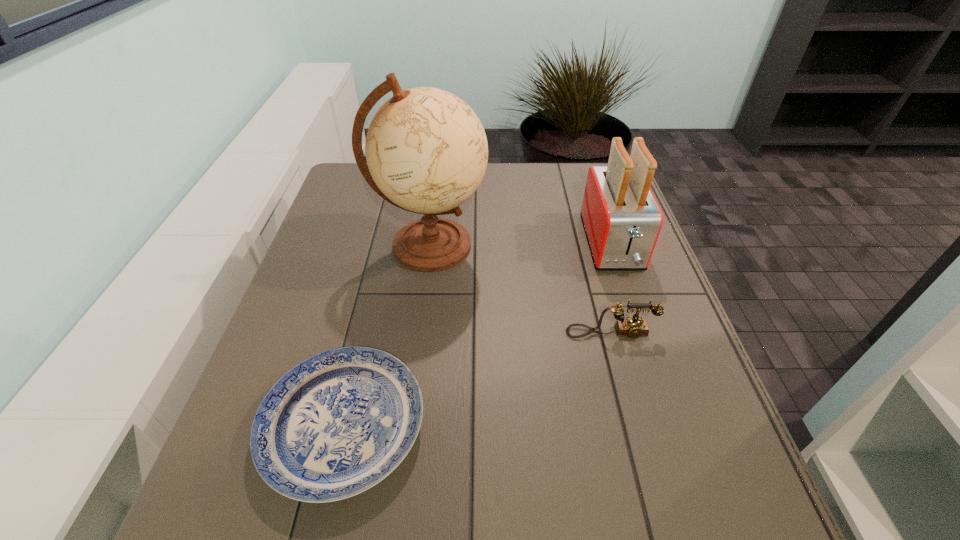
You are a GUI agent. You are given a task and a screenshot of the screen. Output one action in this format:
    pyautogui.click(x=<x>, y=<y>)
    Task: Click on the free space between the telephone and the tallest object
    The image size is (960, 540).
    Given the screenshot: What is the action you would take?
    pyautogui.click(x=520, y=289)

You are a GUI agent. You are given a task and a screenshot of the screen. Output one action in this format:
    pyautogui.click(x=<x>, y=<y>)
    Task: Click on the free space between the telephone and the second tallest object
    This screenshot has height=540, width=960.
    Given the screenshot: What is the action you would take?
    pyautogui.click(x=612, y=288)

You are a GUI agent. You are given a task and a screenshot of the screen. Output one action in this format:
    pyautogui.click(x=<x>, y=<y>)
    Task: Click on the empty location between the shortest object and the globe
    This screenshot has width=960, height=540.
    Given the screenshot: What is the action you would take?
    pyautogui.click(x=387, y=336)

Locate an element on the screen. This screenshot has height=540, width=960. vacant area between the third shortest object and the nearest object is located at coordinates (478, 335).

Where is `vacant region between the telephone and the plate`? Image resolution: width=960 pixels, height=540 pixels. vacant region between the telephone and the plate is located at coordinates (477, 380).

Where is `unoccupied area between the globe and the telephone`? The image size is (960, 540). unoccupied area between the globe and the telephone is located at coordinates (520, 289).

Where is `unoccupied position between the nearest object and the third shortest object`? The width and height of the screenshot is (960, 540). unoccupied position between the nearest object and the third shortest object is located at coordinates (478, 335).

Locate an element on the screen. The width and height of the screenshot is (960, 540). free space that is in between the third tallest object and the plate is located at coordinates (477, 380).

I want to click on free space between the nearest object and the globe, so click(387, 336).

I want to click on object that is the third closest to the plate, so click(622, 219).